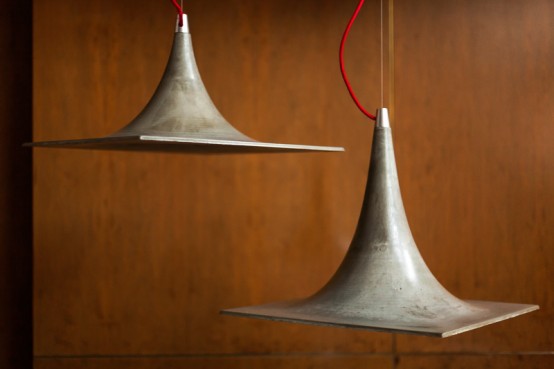
Where is `bottom right of the wall`? This screenshot has width=554, height=369. bottom right of the wall is located at coordinates (428, 363).